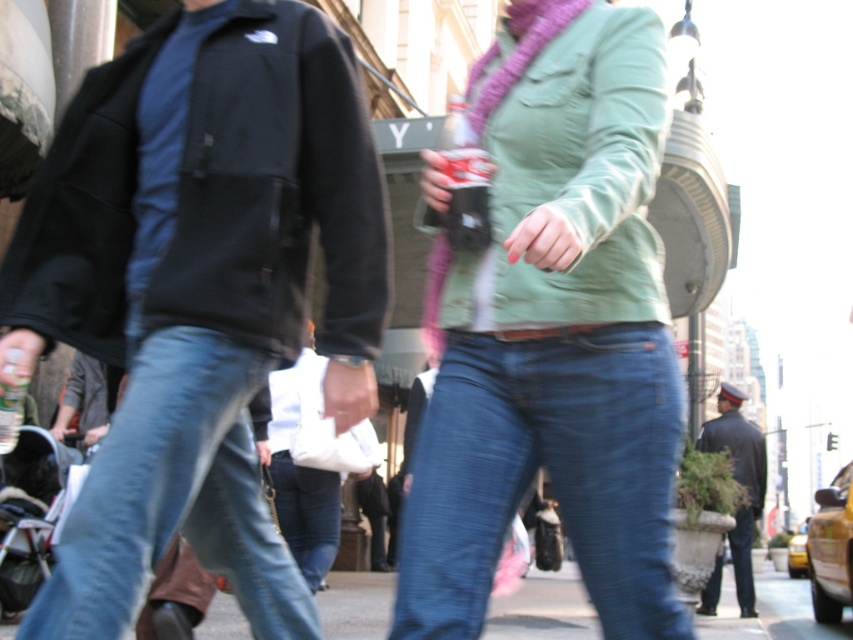
Question: Considering the relative positions of yellow rubber taxi at lower right and denim jeans at center in the image provided, where is yellow rubber taxi at lower right located with respect to denim jeans at center?

Choices:
 (A) below
 (B) above

Answer: (A)

Question: Is matte green jacket at center to the left of blue denim jeans at lower left from the viewer's perspective?

Choices:
 (A) no
 (B) yes

Answer: (A)

Question: Which object is the farthest from the matte green jacket at center?

Choices:
 (A) blue denim jeans at center
 (B) black fleece jacket at left

Answer: (B)

Question: Which point is closer to the camera?

Choices:
 (A) denim jeans at center
 (B) black fleece jacket at left

Answer: (B)

Question: Is blue denim jeans at center positioned at the back of blue denim jeans at lower left?

Choices:
 (A) no
 (B) yes

Answer: (B)

Question: Among these objects, which one is nearest to the camera?

Choices:
 (A) yellow rubber taxi at lower right
 (B) blue denim jeans at lower left
 (C) denim jeans at center

Answer: (B)